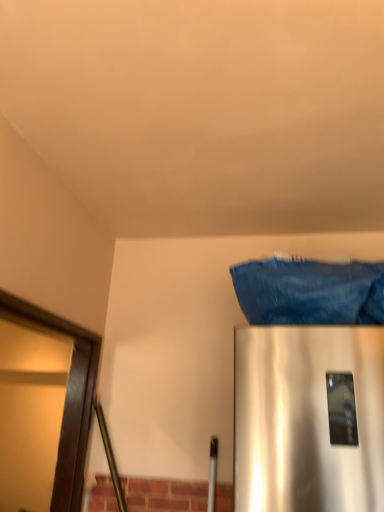
Question: From the image's perspective, is denim fabric at upper right above or below dark brown wooden frame at left?

Choices:
 (A) above
 (B) below

Answer: (A)

Question: Looking at their shapes, would you say denim fabric at upper right is wider or thinner than dark brown wooden frame at left?

Choices:
 (A) wide
 (B) thin

Answer: (A)

Question: Is denim fabric at upper right spatially inside dark brown wooden frame at left, or outside of it?

Choices:
 (A) inside
 (B) outside

Answer: (B)

Question: Considering their positions, is dark brown wooden frame at left located in front of or behind denim fabric at upper right?

Choices:
 (A) front
 (B) behind

Answer: (A)

Question: Is point (11, 317) closer or farther from the camera than point (339, 303)?

Choices:
 (A) closer
 (B) farther

Answer: (B)

Question: From a real-world perspective, is dark brown wooden frame at left physically located above or below denim fabric at upper right?

Choices:
 (A) above
 (B) below

Answer: (B)

Question: Is dark brown wooden frame at left inside or outside of denim fabric at upper right?

Choices:
 (A) outside
 (B) inside

Answer: (A)